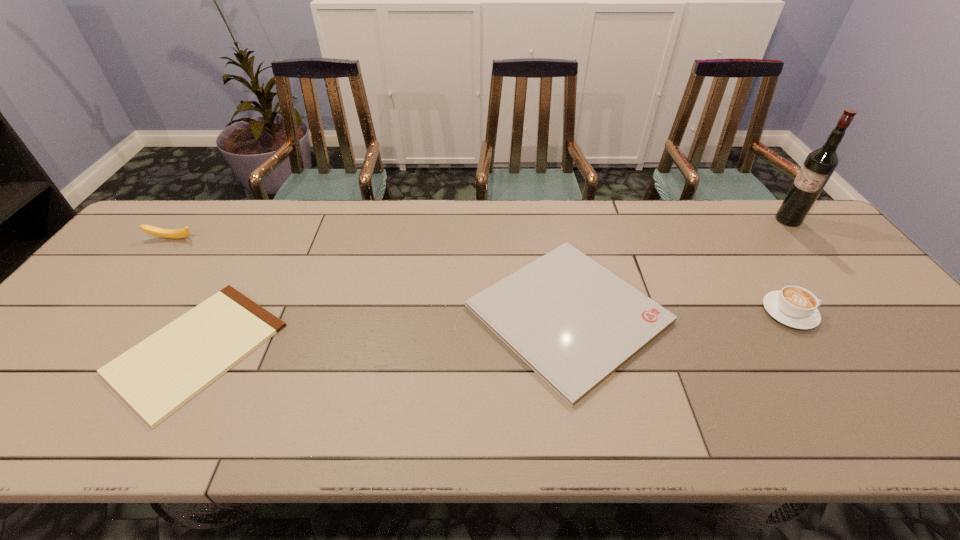
This screenshot has height=540, width=960. What are the coordinates of `free space that satisfies the following two spatial constraints: 1. on the back side of the right clipboard; 2. on the right side of the shorter clipboard` in the screenshot? It's located at (217, 314).